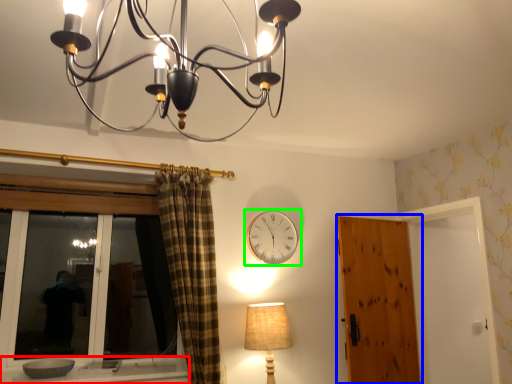
Question: Based on their relative distances, which object is farther from window sill (highlighted by a red box)? Choose from door (highlighted by a blue box) and wall clock (highlighted by a green box).

Choices:
 (A) door
 (B) wall clock

Answer: (A)